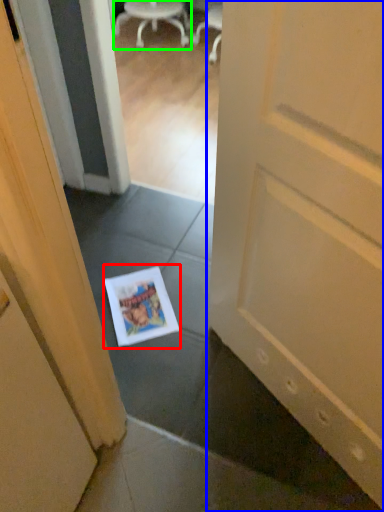
Question: Which is nearer to the magazine (highlighted by a red box)? door (highlighted by a blue box) or chair (highlighted by a green box).

Choices:
 (A) door
 (B) chair

Answer: (A)